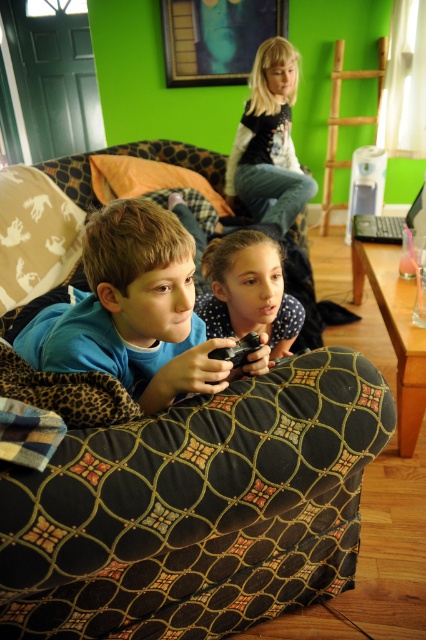
You are standing in the room and want to place a small table between the two points labeled point (72, 456) and point (261, 262). Based on their positions, will the table be closer to the wall or the center of the room?

The table placed between point (72, 456) and point (261, 262) will be closer to the wall because point (72, 456) is in front of point (261, 262), indicating that the area between them is nearer to the wall.

You are a parent trying to place a new decorative pillow on the highest point between the black fabric couch at lower center and the polka dot shirt at center. Which object should you choose to place the pillow on?

The black fabric couch at lower center has a greater height compared to the polka dot shirt at center, so you should place the decorative pillow on the black fabric couch at lower center.

You are a parent trying to ensure your children are sitting safely during their game session. The recommended safe distance between a child and any furniture is at least 50 centimeters to prevent accidental collisions. Based on the scene, is the distance between the black fabric couch at lower center and the polka dot shirt at center meeting this safety guideline?

The black fabric couch at lower center and the polka dot shirt at center are 50.51 centimeters apart, which meets the recommended safe distance of at least 50 centimeters to prevent accidental collisions.